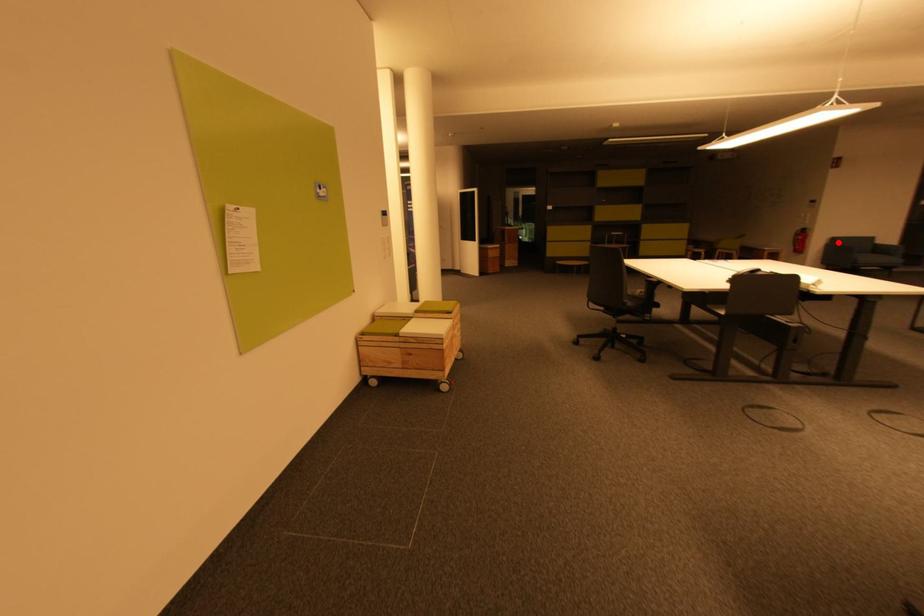
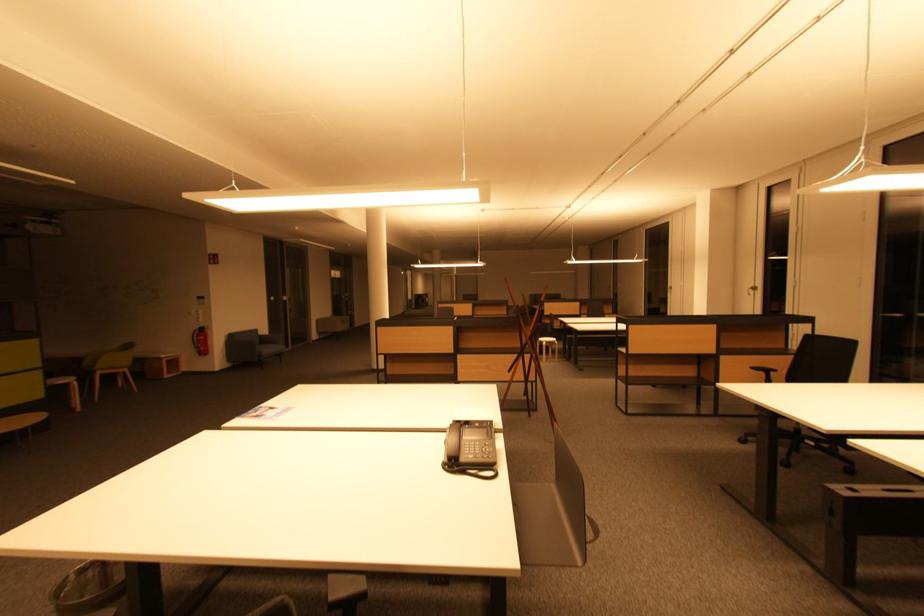
Question: I am providing you with two images of the same scene from different viewpoints. In image1, a red point is highlighted. Considering the same 3D point in image2, which of the following is correct?

Choices:
 (A) It is closer
 (B) It is farther

Answer: (A)